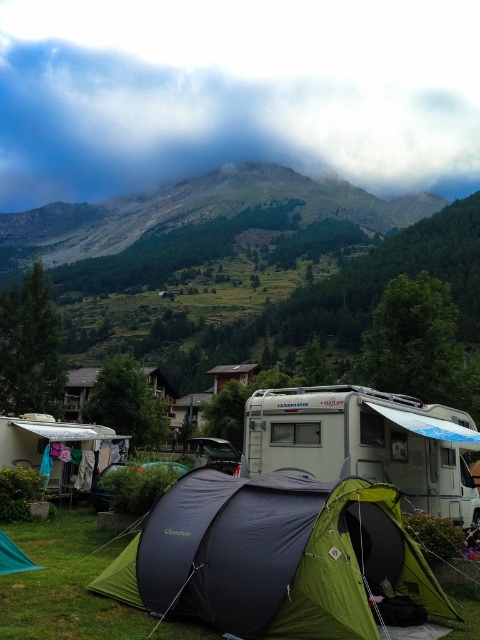
Question: Which of the following is the farthest from the observer?

Choices:
 (A) green fabric tent at center
 (B) metallic silver recreational vehicle at center

Answer: (B)

Question: Is green fabric tent at center thinner than white plastic camper at center?

Choices:
 (A) yes
 (B) no

Answer: (A)

Question: Which point appears closest to the camera in this image?

Choices:
 (A) (389, 472)
 (B) (227, 444)
 (C) (370, 515)

Answer: (C)

Question: Does white plastic camper at center appear on the left side of metallic silver recreational vehicle at center?

Choices:
 (A) no
 (B) yes

Answer: (A)

Question: Is cloudy sky at upper center positioned behind green fabric tent at center?

Choices:
 (A) no
 (B) yes

Answer: (B)

Question: Which point appears closest to the camera in this image?

Choices:
 (A) (97, 49)
 (B) (422, 499)
 (C) (213, 461)

Answer: (B)